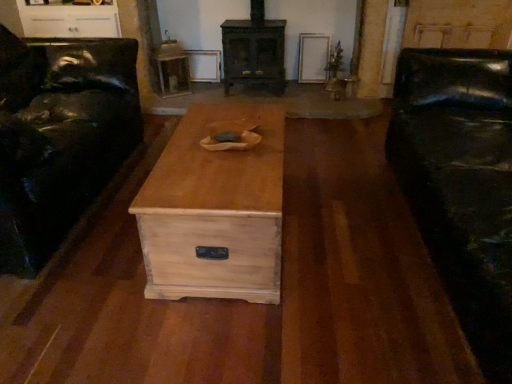
Question: Should I look upward or downward to see wooden side table at upper center?

Choices:
 (A) up
 (B) down

Answer: (A)

Question: Is dark brown wood fireplace at center facing towards wooden side table at upper center?

Choices:
 (A) no
 (B) yes

Answer: (A)

Question: Is dark brown wood fireplace at center outside wooden side table at upper center?

Choices:
 (A) no
 (B) yes

Answer: (B)

Question: From a real-world perspective, is dark brown wood fireplace at center on top of wooden side table at upper center?

Choices:
 (A) no
 (B) yes

Answer: (B)

Question: Does dark brown wood fireplace at center have a smaller size compared to wooden side table at upper center?

Choices:
 (A) no
 (B) yes

Answer: (A)

Question: Is dark brown wood fireplace at center wider than wooden side table at upper center?

Choices:
 (A) no
 (B) yes

Answer: (B)

Question: Considering the relative sizes of dark brown wood fireplace at center and wooden side table at upper center in the image provided, is dark brown wood fireplace at center thinner than wooden side table at upper center?

Choices:
 (A) yes
 (B) no

Answer: (B)

Question: From the image's perspective, is black leather couch at right above dark brown wood fireplace at center?

Choices:
 (A) yes
 (B) no

Answer: (B)

Question: Does black leather couch at right have a lesser height compared to dark brown wood fireplace at center?

Choices:
 (A) no
 (B) yes

Answer: (A)

Question: Is the depth of black leather couch at right greater than that of dark brown wood fireplace at center?

Choices:
 (A) no
 (B) yes

Answer: (A)

Question: Is black leather couch at right aimed at dark brown wood fireplace at center?

Choices:
 (A) yes
 (B) no

Answer: (B)

Question: From a real-world perspective, is black leather couch at right located beneath dark brown wood fireplace at center?

Choices:
 (A) no
 (B) yes

Answer: (B)

Question: Is black leather couch at right wider than dark brown wood fireplace at center?

Choices:
 (A) yes
 (B) no

Answer: (A)

Question: Is natural wood chest at center oriented towards matte black leather couch at left?

Choices:
 (A) yes
 (B) no

Answer: (A)